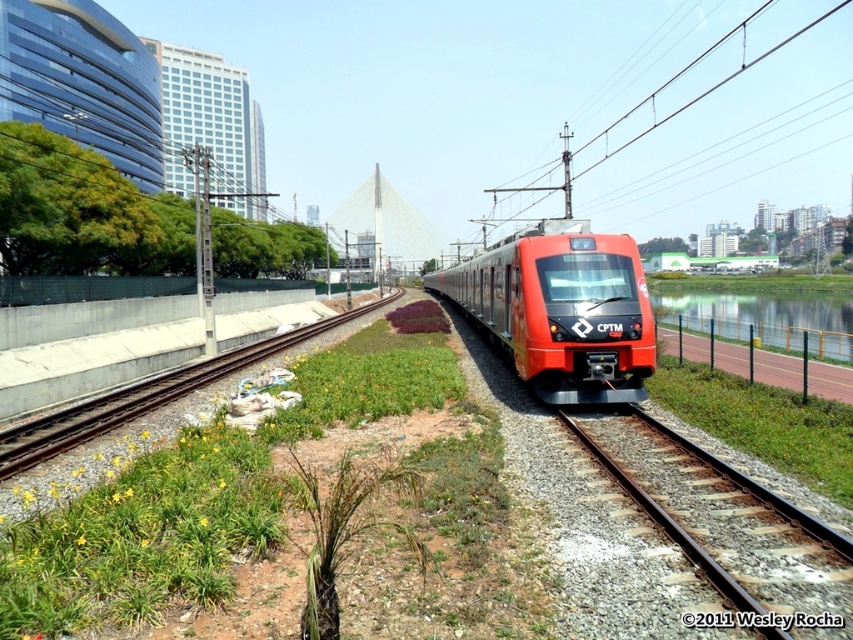
Does shiny orange train at center have a greater width compared to concrete at left?

Incorrect, shiny orange train at center's width does not surpass concrete at left's.

Locate an element on the screen. shiny orange train at center is located at coordinates (561, 308).

Image resolution: width=853 pixels, height=640 pixels. In order to click on shiny orange train at center in this screenshot , I will do `click(561, 308)`.

Does point (538, 301) come closer to viewer compared to point (701, 330)?

That is True.

Who is taller, shiny orange train at center or green water at right?

With more height is shiny orange train at center.

Between point (621, 252) and point (827, 346), which one is positioned in front?

Point (621, 252) is more forward.

The width and height of the screenshot is (853, 640). What are the coordinates of `shiny orange train at center` in the screenshot? It's located at (561, 308).

What do you see at coordinates (143, 396) in the screenshot? I see `concrete at left` at bounding box center [143, 396].

Which of these two, concrete at left or green water at right, stands shorter?

Standing shorter between the two is concrete at left.

Where is `concrete at left`? The height and width of the screenshot is (640, 853). concrete at left is located at coordinates (143, 396).